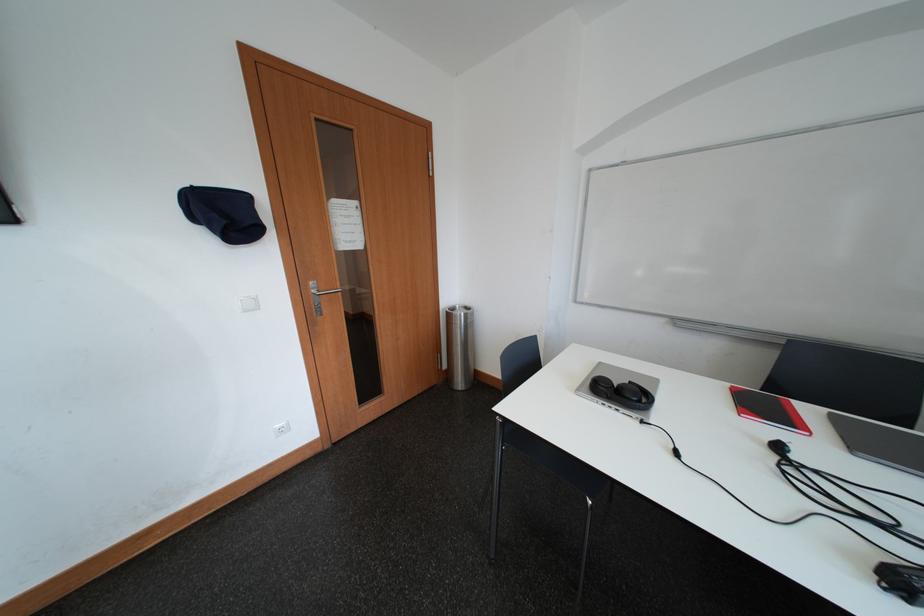
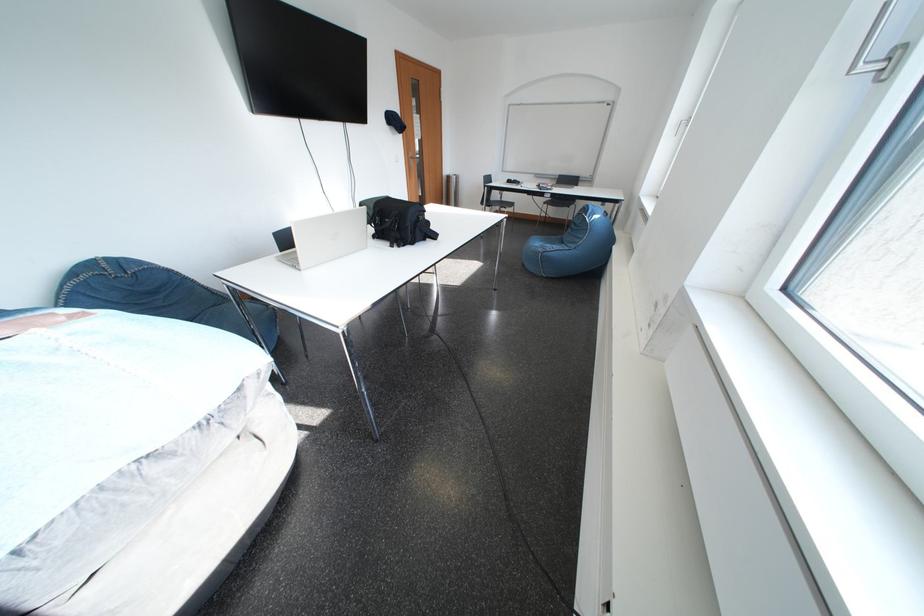
Which direction would the cameraman need to move to produce the second image?

The cameraman walked toward left, backward.